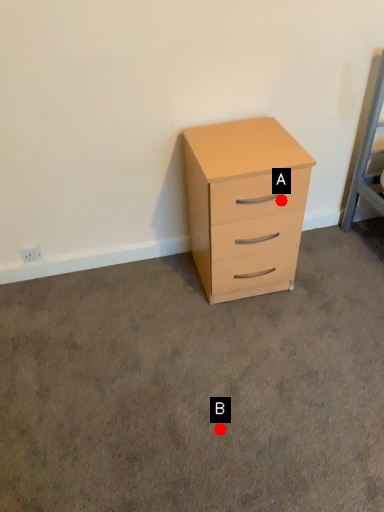
Question: Two points are circled on the image, labeled by A and B beside each circle. Among these points, which one is farthest from the camera?

Choices:
 (A) A is further
 (B) B is further

Answer: (A)